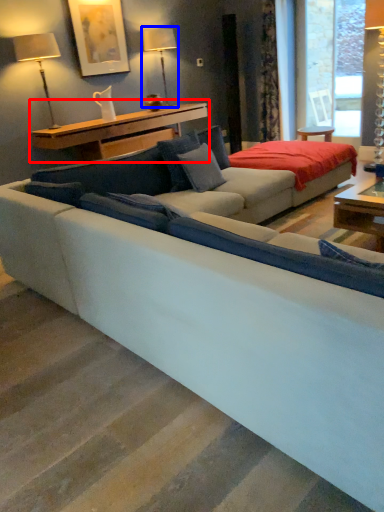
Question: Which object is further to the camera taking this photo, table (highlighted by a red box) or table lamp (highlighted by a blue box)?

Choices:
 (A) table
 (B) table lamp

Answer: (B)